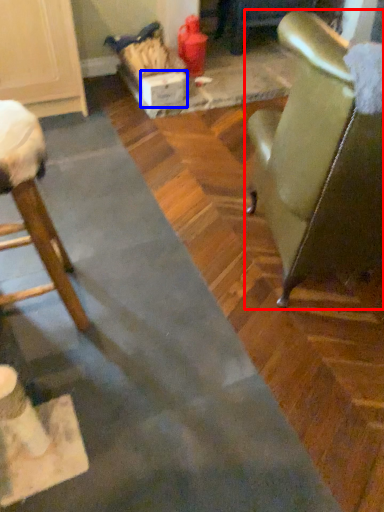
Question: Which object is further to the camera taking this photo, chair (highlighted by a red box) or cardboard box (highlighted by a blue box)?

Choices:
 (A) chair
 (B) cardboard box

Answer: (B)